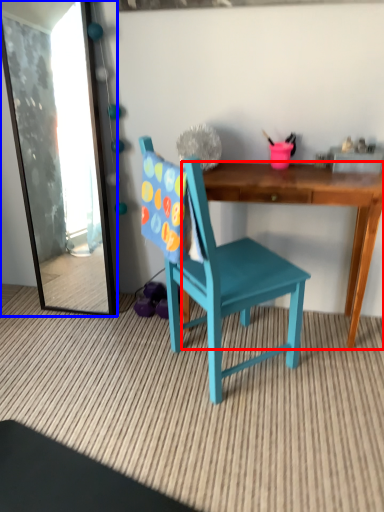
Question: Among these objects, which one is farthest to the camera, desk (highlighted by a red box) or mirror (highlighted by a blue box)?

Choices:
 (A) desk
 (B) mirror

Answer: (B)